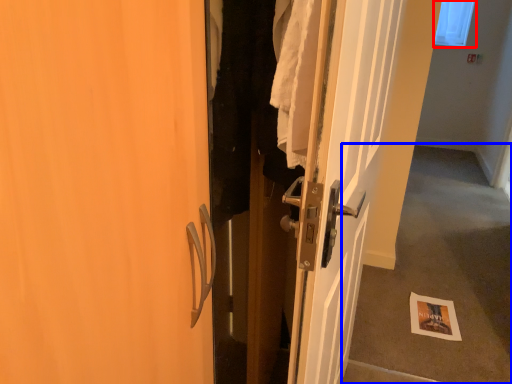
Question: Which object is further to the camera taking this photo, window screen (highlighted by a red box) or corridor (highlighted by a blue box)?

Choices:
 (A) window screen
 (B) corridor

Answer: (A)